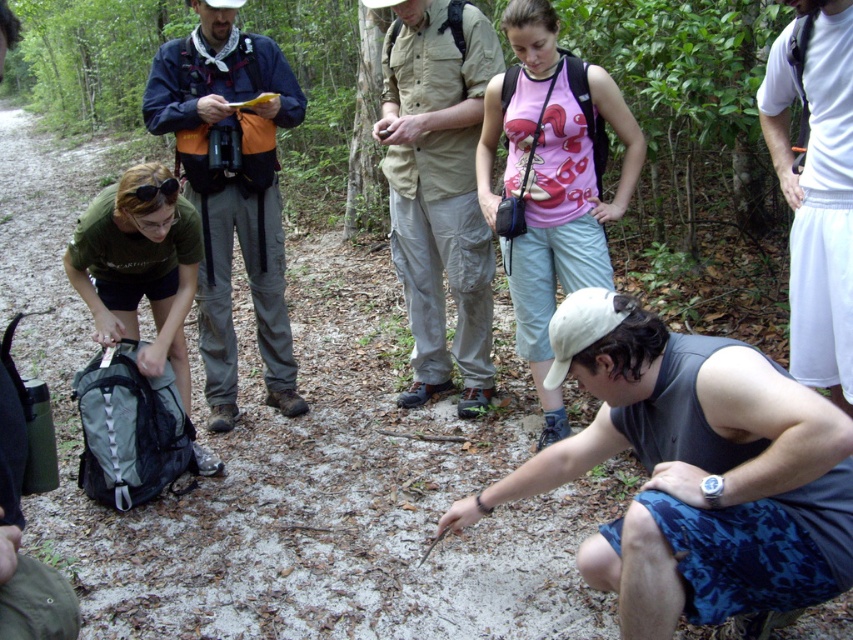
You are a photographer trying to capture a photo of the gray fabric shorts at lower right and the white cotton shirt at upper right. Which of the two items should you focus on first if you want to ensure both are in focus without adjusting the camera settings?

The gray fabric shorts at lower right is not as tall as the white cotton shirt at upper right, so you should focus on the white cotton shirt at upper right first because it is taller and will require a closer focus point, ensuring the shorter gray fabric shorts at lower right will also be in focus.